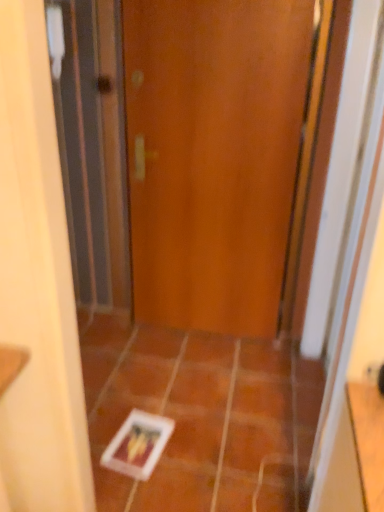
Question: From a real-world perspective, is wooden door at center on orange matte tile at center, which ranks as the first ceramic tile in right-to-left order?

Choices:
 (A) yes
 (B) no

Answer: (A)

Question: From the image's perspective, is wooden door at center above orange matte tile at center, the 2th ceramic tile positioned from the left?

Choices:
 (A) yes
 (B) no

Answer: (A)

Question: Does wooden door at center have a lesser height compared to orange matte tile at center, which ranks as the first ceramic tile in right-to-left order?

Choices:
 (A) yes
 (B) no

Answer: (B)

Question: Can you confirm if wooden door at center is bigger than orange matte tile at center, which ranks as the first ceramic tile in right-to-left order?

Choices:
 (A) no
 (B) yes

Answer: (B)

Question: From a real-world perspective, is wooden door at center below orange matte tile at center, the 2th ceramic tile positioned from the left?

Choices:
 (A) no
 (B) yes

Answer: (A)

Question: In terms of width, does white glossy tile at center, arranged as the 1th ceramic tile when viewed from the left, look wider or thinner when compared to wooden door at center?

Choices:
 (A) thin
 (B) wide

Answer: (B)

Question: In the image, is white glossy tile at center, arranged as the 1th ceramic tile when viewed from the left, positioned in front of or behind wooden door at center?

Choices:
 (A) front
 (B) behind

Answer: (A)

Question: Does point (294, 366) appear closer or farther from the camera than point (269, 189)?

Choices:
 (A) farther
 (B) closer

Answer: (A)

Question: Would you say white glossy tile at center, arranged as the 1th ceramic tile when viewed from the left, is inside or outside wooden door at center?

Choices:
 (A) outside
 (B) inside

Answer: (A)

Question: In terms of size, does white glossy tile at center, arranged as the 1th ceramic tile when viewed from the left, appear bigger or smaller than orange matte tile at center, which ranks as the first ceramic tile in right-to-left order?

Choices:
 (A) small
 (B) big

Answer: (B)

Question: Does point (307, 421) appear closer or farther from the camera than point (281, 448)?

Choices:
 (A) closer
 (B) farther

Answer: (B)

Question: In terms of height, does white glossy tile at center, which is the second ceramic tile in right-to-left order, look taller or shorter compared to orange matte tile at center, which ranks as the first ceramic tile in right-to-left order?

Choices:
 (A) short
 (B) tall

Answer: (B)

Question: In terms of width, does white glossy tile at center, arranged as the 1th ceramic tile when viewed from the left, look wider or thinner when compared to orange matte tile at center, the 2th ceramic tile positioned from the left?

Choices:
 (A) thin
 (B) wide

Answer: (B)

Question: Is point tap(233, 429) closer or farther from the camera than point tap(147, 333)?

Choices:
 (A) farther
 (B) closer

Answer: (B)

Question: Is orange matte tile at center, which ranks as the first ceramic tile in right-to-left order, in front of or behind white glossy tile at center, arranged as the 1th ceramic tile when viewed from the left, in the image?

Choices:
 (A) behind
 (B) front

Answer: (A)